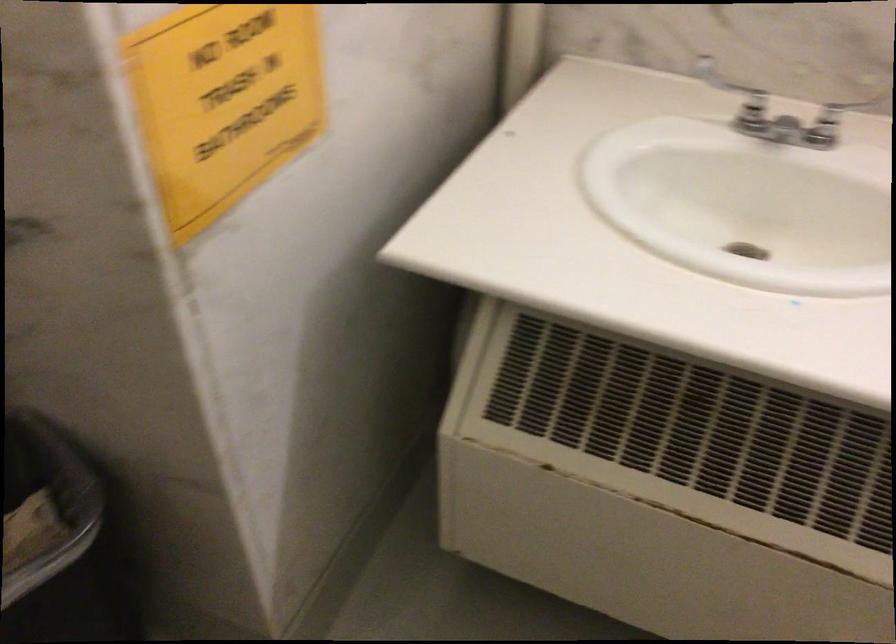
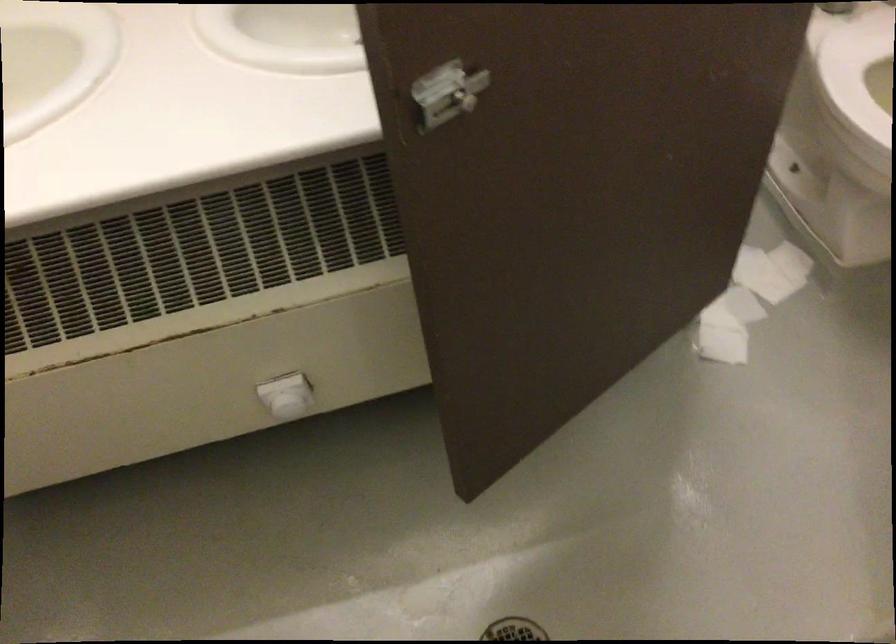
First-person continuous shooting, in which direction is the camera rotating?

The camera's rotation is toward right-down.